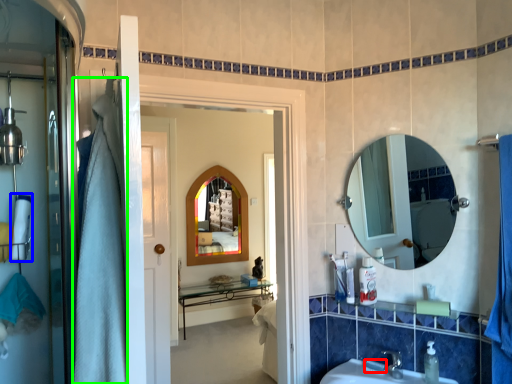
Question: Based on their relative distances, which object is nearer to soap (highlighted by a red box)? Choose from bath towel (highlighted by a blue box) and shower curtain (highlighted by a green box).

Choices:
 (A) bath towel
 (B) shower curtain

Answer: (B)